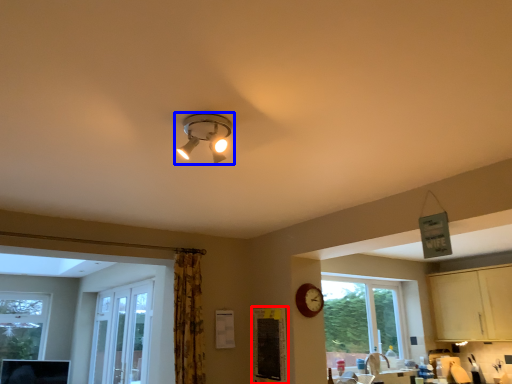
Question: Which object appears farthest to the camera in this image, bulletin board (highlighted by a red box) or lamp (highlighted by a blue box)?

Choices:
 (A) bulletin board
 (B) lamp

Answer: (A)